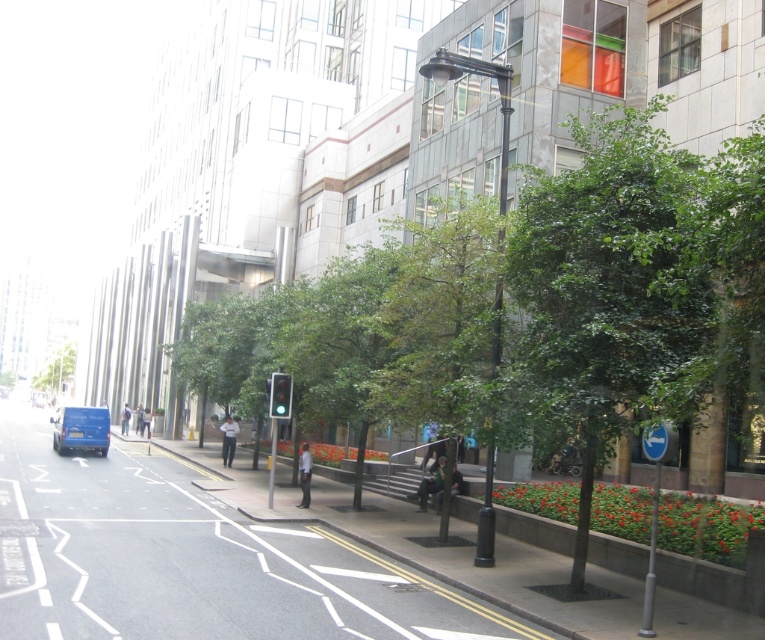
Looking at this image, which is more to the left, smooth concrete pavement at center or blue plastic sign at lower right?

smooth concrete pavement at center is more to the left.

Consider the image. Between smooth concrete pavement at center and blue plastic sign at lower right, which one has more height?

smooth concrete pavement at center

Is point (51, 577) behind point (662, 452)?

That is True.

Find the location of `smooth concrete pavement at center`. smooth concrete pavement at center is located at coordinates (191, 560).

Is blue plastic sign at lower right shorter than green leafy tree at left?

Yes, blue plastic sign at lower right is shorter than green leafy tree at left.

Can you confirm if blue plastic sign at lower right is positioned to the right of green leafy tree at left?

Indeed, blue plastic sign at lower right is positioned on the right side of green leafy tree at left.

Is point (650, 531) behind point (50, 380)?

No, it is not.

At what (x,y) coordinates should I click in order to perform the action: click on blue plastic sign at lower right. Please return your answer as a coordinate pair (x, y). The width and height of the screenshot is (765, 640). Looking at the image, I should click on (653, 506).

Between smooth concrete pavement at center and blue matte van at left, which one appears on the right side from the viewer's perspective?

smooth concrete pavement at center

Who is more forward, (142,472) or (103,442)?

Point (142,472) is in front.

The width and height of the screenshot is (765, 640). I want to click on smooth concrete pavement at center, so click(191, 560).